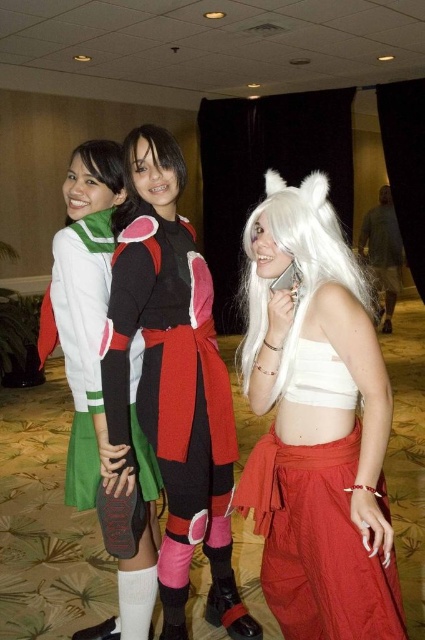
Question: Based on their relative distances, which object is farther from the white silky wig at center?

Choices:
 (A) matte black wig at center
 (B) green fabric skirt at center

Answer: (B)

Question: From the image, what is the correct spatial relationship of white fabric skirt at center in relation to green fabric skirt at center?

Choices:
 (A) below
 (B) above

Answer: (B)

Question: Which point is closer to the camera?

Choices:
 (A) white silky wig at center
 (B) white fabric skirt at center
 (C) green fabric skirt at center
 (D) matte black and red costume at center

Answer: (B)

Question: Is white silky wig at center thinner than matte black wig at center?

Choices:
 (A) yes
 (B) no

Answer: (B)

Question: Is matte black and red costume at center thinner than green fabric skirt at center?

Choices:
 (A) no
 (B) yes

Answer: (A)

Question: Which point is farther to the camera?

Choices:
 (A) (155, 438)
 (B) (314, 602)

Answer: (A)